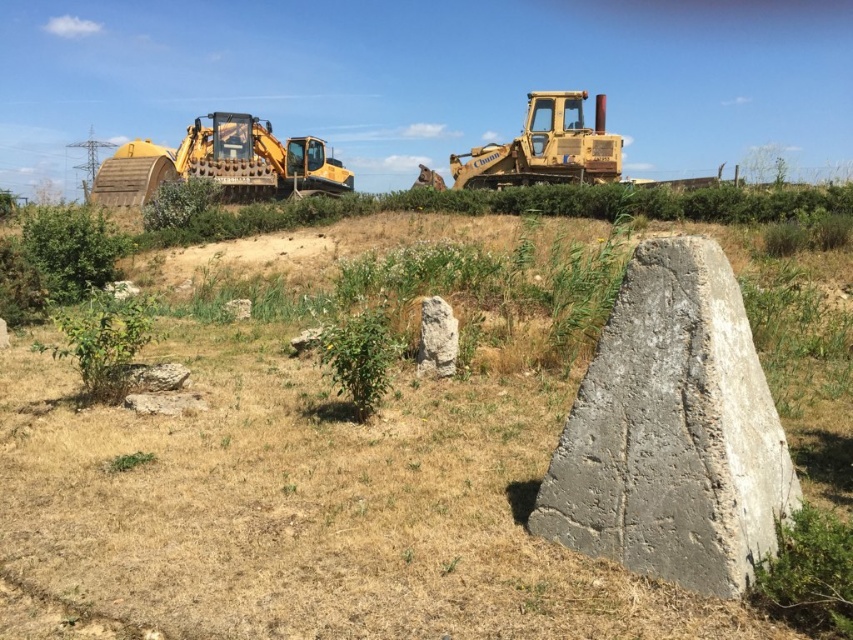
Who is lower down, gray concrete boulder at center or gray rough stone at center?

Positioned lower is gray concrete boulder at center.

Is point (743, 465) positioned behind point (424, 330)?

That is False.

Locate an element on the screen. gray concrete boulder at center is located at coordinates (672, 432).

Which is more to the right, dry grass at center or gray rough stone at center?

From the viewer's perspective, dry grass at center appears more on the right side.

Does point (444, 388) lie behind point (453, 333)?

No, (444, 388) is in front of (453, 333).

Find the location of `dry grass at center`. dry grass at center is located at coordinates (338, 454).

Is point (769, 538) positioned in front of point (219, 118)?

Yes, it is in front of point (219, 118).

Who is more distant from viewer, (711,561) or (281,177)?

The point (281,177) is more distant.

Identify the location of gray concrete boulder at center. (672, 432).